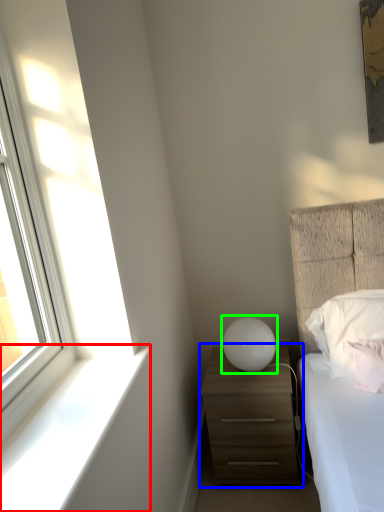
Question: Which object is the farthest from window sill (highlighted by a red box)? Choose among these: chest of drawers (highlighted by a blue box) or table lamp (highlighted by a green box).

Choices:
 (A) chest of drawers
 (B) table lamp

Answer: (B)